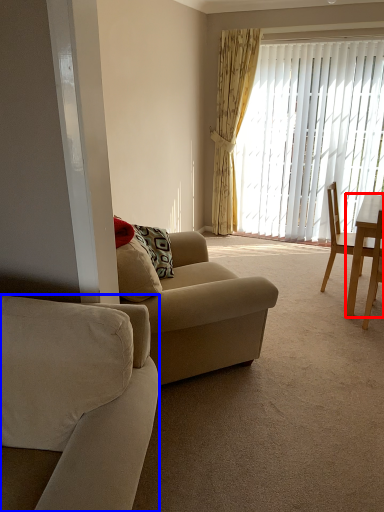
Question: Which object is further to the camera taking this photo, desk (highlighted by a red box) or studio couch (highlighted by a blue box)?

Choices:
 (A) desk
 (B) studio couch

Answer: (A)